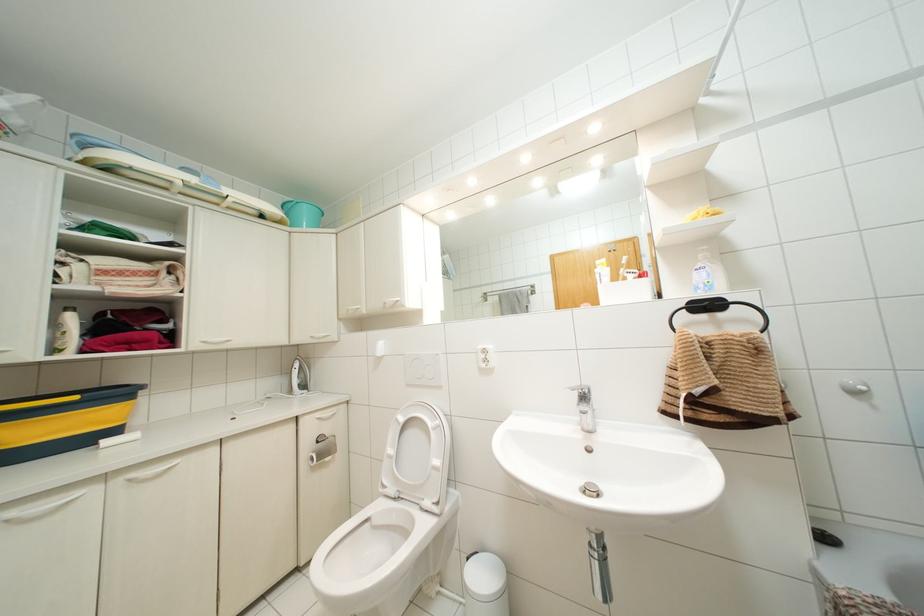
Find the location of a particular element. This screenshot has height=616, width=924. yellow bin handle is located at coordinates (38, 400).